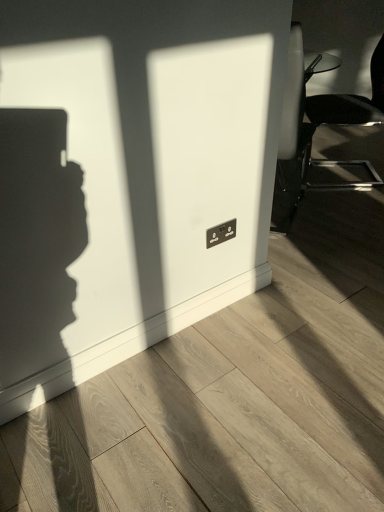
Identify the location of vacant area in front of metallic silver chair at right. The image size is (384, 512). (357, 194).